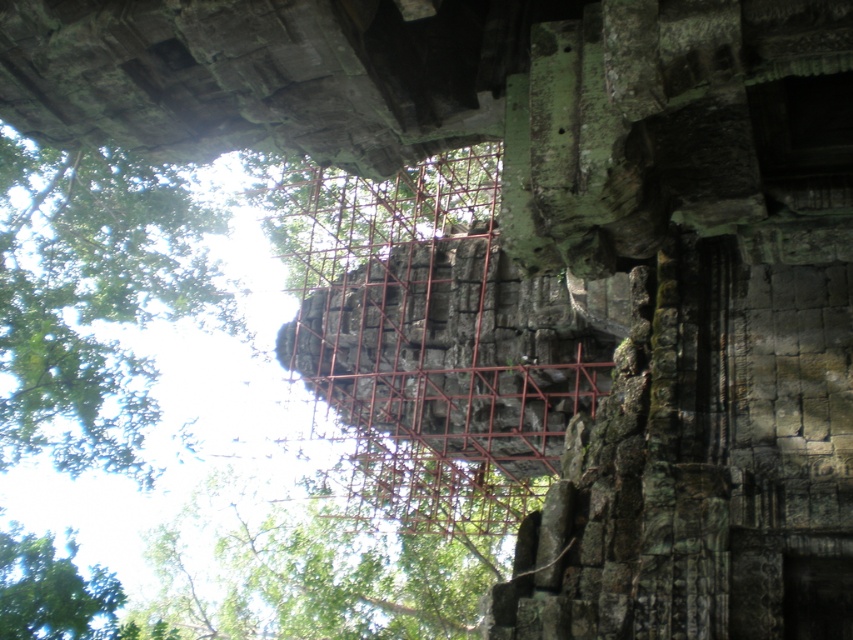
Question: Is green leafy tree at upper left to the right of green stone structure at center from the viewer's perspective?

Choices:
 (A) yes
 (B) no

Answer: (B)

Question: Can you confirm if green leafy tree at upper left is bigger than green stone structure at center?

Choices:
 (A) no
 (B) yes

Answer: (A)

Question: Can you confirm if green leafy tree at upper left is smaller than green stone structure at center?

Choices:
 (A) no
 (B) yes

Answer: (B)

Question: Among these points, which one is farthest from the camera?

Choices:
 (A) (352, 228)
 (B) (138, 476)

Answer: (A)

Question: Among these points, which one is farthest from the camera?

Choices:
 (A) (36, 182)
 (B) (323, 244)

Answer: (B)